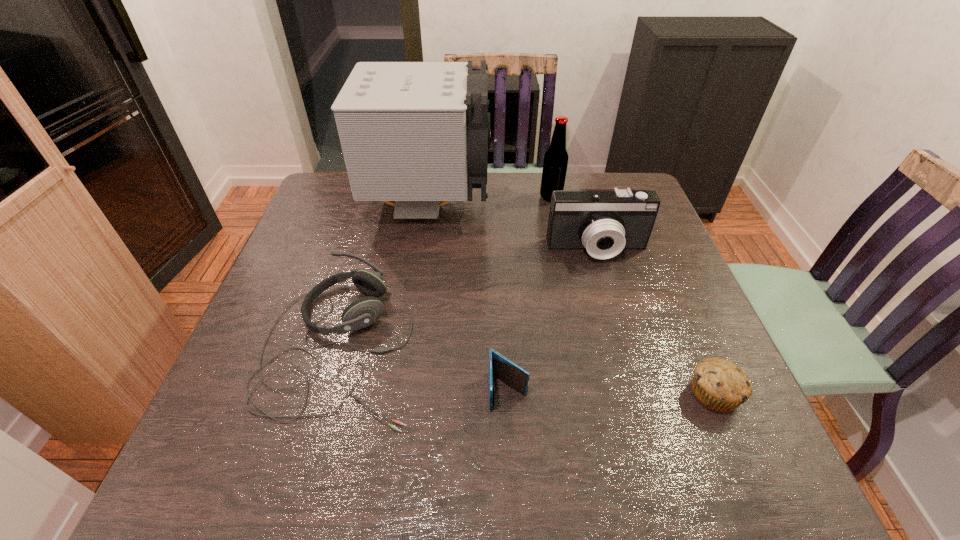
This screenshot has width=960, height=540. I want to click on vacant region located on the left of the muffin, so click(x=570, y=394).

The image size is (960, 540). In order to click on vacant area situated 0.060m on the exterior surface of the wallet in this screenshot , I will do `click(511, 442)`.

I want to click on fan that is at the far edge, so click(x=418, y=133).

Where is `beer bottle positioned at the far edge`? Image resolution: width=960 pixels, height=540 pixels. beer bottle positioned at the far edge is located at coordinates (555, 163).

Where is `object that is positioned at the left edge`? object that is positioned at the left edge is located at coordinates (363, 312).

Locate an element on the screen. Image resolution: width=960 pixels, height=540 pixels. camcorder at the right edge is located at coordinates (604, 222).

The image size is (960, 540). In order to click on muffin at the right edge in this screenshot , I will do `click(719, 385)`.

Where is `vacant region at the near edge`? vacant region at the near edge is located at coordinates (584, 462).

Where is `vacant area at the left edge of the desktop`? This screenshot has width=960, height=540. vacant area at the left edge of the desktop is located at coordinates 342,261.

In the image, there is a desktop. Where is `vacant region at the right edge`? This screenshot has width=960, height=540. vacant region at the right edge is located at coordinates (673, 434).